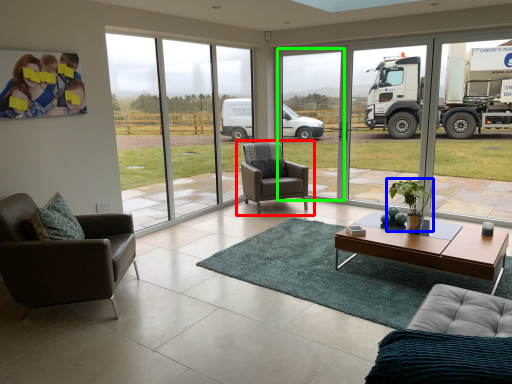
Question: Which object is the farthest from chair (highlighted by a red box)? Choose among these: houseplant (highlighted by a blue box) or window frame (highlighted by a green box).

Choices:
 (A) houseplant
 (B) window frame

Answer: (B)